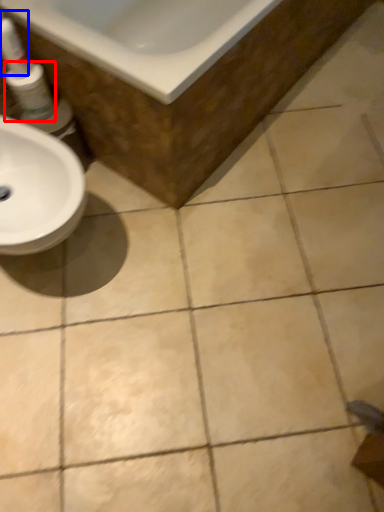
Question: Which object is closer to the camera taking this photo, mouthwash (highlighted by a red box) or cleaning product (highlighted by a blue box)?

Choices:
 (A) mouthwash
 (B) cleaning product

Answer: (B)